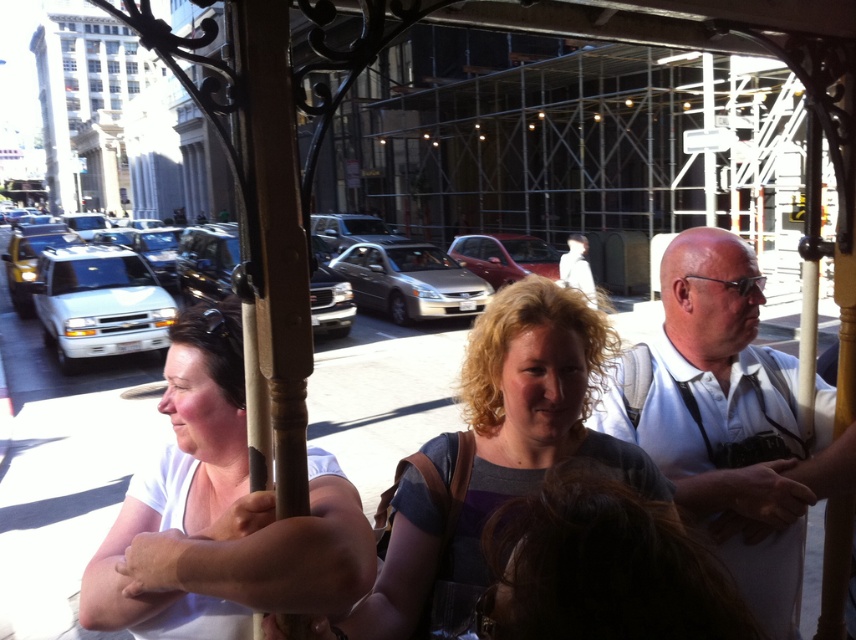
You are a photographer trying to capture a candid shot of the two people wearing the white matte shirt at center and the matte gray shirt at center. Since the person with the camera is sitting on the right, which person should you focus on first to ensure they are in the frame?

The white matte shirt at center is thinner than the matte gray shirt at center, so you should focus on the white matte shirt at center first as it may be easier to frame due to its narrower width.

You are a passenger in the tram and want to take a photo of the urban street scene through the window. You have two points marked on the window where you can aim your camera. The first point is at coordinates point (753,580) and the second is at point (480,570). Which point will give you a clearer view of the street scene?

Point (753,580) is further to the camera than point (480,570). Since it is closer to the camera, it will provide a clearer view of the street scene.